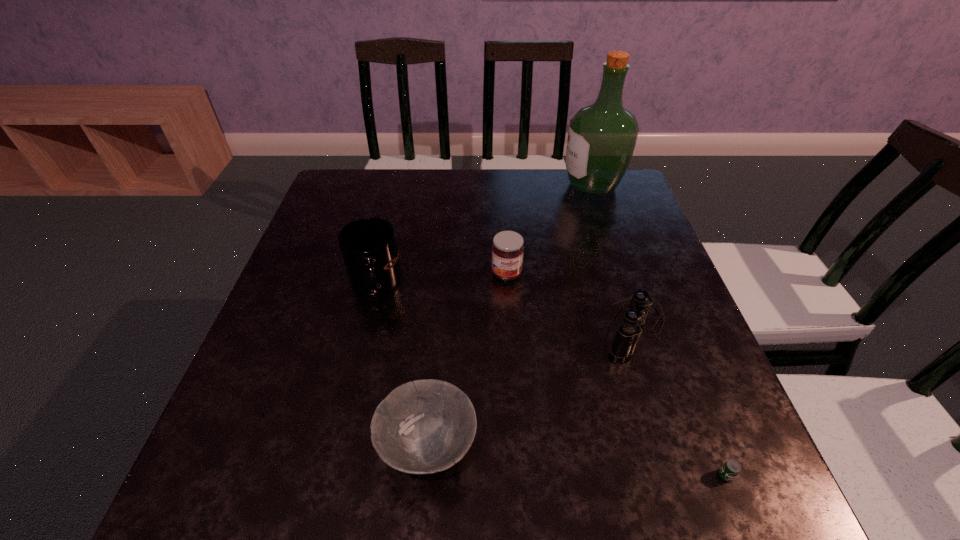
At what (x,y) coordinates should I click in order to perform the action: click on vacant space located 0.190m on the front-facing side of the tallest object. Please return your answer as a coordinate pair (x, y). Looking at the image, I should click on (498, 186).

At what (x,y) coordinates should I click in order to perform the action: click on vacant space located on the front-facing side of the tallest object. Please return your answer as a coordinate pair (x, y). The height and width of the screenshot is (540, 960). Looking at the image, I should click on (528, 186).

This screenshot has height=540, width=960. Find the location of `vacant space located with the handle on the side of the fifth shortest object`. vacant space located with the handle on the side of the fifth shortest object is located at coordinates (328, 476).

Where is `blank space located on the front of the jam`? Image resolution: width=960 pixels, height=540 pixels. blank space located on the front of the jam is located at coordinates (517, 453).

Locate an element on the screen. Image resolution: width=960 pixels, height=540 pixels. vacant space situated on the left of the binoculars is located at coordinates (470, 326).

You are a GUI agent. You are given a task and a screenshot of the screen. Output one action in this format:
    pyautogui.click(x=<x>, y=<y>)
    Task: Click on the vacant space situated on the back of the second object from left to right
    This screenshot has height=540, width=960.
    Given the screenshot: What is the action you would take?
    pyautogui.click(x=439, y=324)

This screenshot has height=540, width=960. What are the coordinates of `vacant space located on the left of the shortest object` in the screenshot? It's located at (661, 475).

At what (x,y) coordinates should I click in order to perform the action: click on object that is at the far edge. Please return your answer as a coordinate pair (x, y). The width and height of the screenshot is (960, 540). Looking at the image, I should click on (601, 139).

Identify the location of bowl that is at the near edge. (426, 426).

The width and height of the screenshot is (960, 540). I want to click on beer can positioned at the near edge, so click(x=731, y=468).